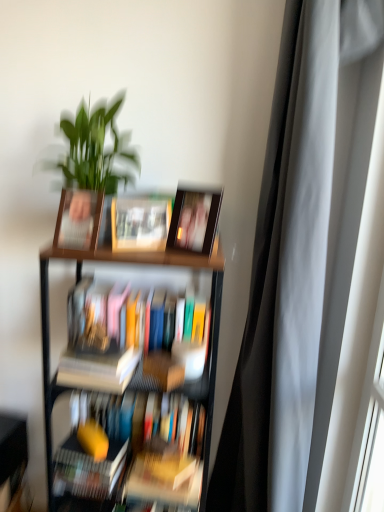
What do you see at coordinates (98, 370) in the screenshot?
I see `hardcover book at center, acting as the 2th book starting from the bottom` at bounding box center [98, 370].

Image resolution: width=384 pixels, height=512 pixels. What do you see at coordinates (130, 368) in the screenshot?
I see `wooden bookcase at center` at bounding box center [130, 368].

What is the approximate height of hardcover books at center, the 3th book ordered from the bottom?

hardcover books at center, the 3th book ordered from the bottom, is 9.67 inches in height.

Find the location of a particular element. matte wooden photo frame at center, which is the 4th book in bottom-to-top order is located at coordinates (140, 223).

This screenshot has width=384, height=512. I want to click on hardcover book at center, the third book when ordered from top to bottom, so click(98, 370).

Does hardcover book at center, acting as the 2th book starting from the bottom, lie in front of matte plastic picture frame at upper left, which is counted as the 2th picture frame, starting from the right?

No, hardcover book at center, acting as the 2th book starting from the bottom, is behind matte plastic picture frame at upper left, which is counted as the 2th picture frame, starting from the right.

From a real-world perspective, who is located higher, hardcover book at center, the third book when ordered from top to bottom, or matte plastic picture frame at upper left, marked as the 1th picture frame in a left-to-right arrangement?

matte plastic picture frame at upper left, marked as the 1th picture frame in a left-to-right arrangement.

Can you confirm if hardcover book at center, acting as the 2th book starting from the bottom, is positioned to the right of matte plastic picture frame at upper left, marked as the 1th picture frame in a left-to-right arrangement?

Yes.

Is matte plastic picture frame at upper left, which is counted as the 2th picture frame, starting from the right, surrounded by hardcover book at center, the third book when ordered from top to bottom?

Definitely not — matte plastic picture frame at upper left, which is counted as the 2th picture frame, starting from the right, is not inside hardcover book at center, the third book when ordered from top to bottom.

From a real-world perspective, starting from the matte wooden picture frame at upper center, placed as the second picture frame when sorted from left to right, which book is the 1st one below it? Please provide its 2D coordinates.

[(140, 223)]

Can you tell me how much matte wooden photo frame at center, which is the 4th book in bottom-to-top order, and matte wooden picture frame at upper center, placed as the second picture frame when sorted from left to right, differ in facing direction?

48.2 degrees separate the facing orientations of matte wooden photo frame at center, which is the 4th book in bottom-to-top order, and matte wooden picture frame at upper center, placed as the second picture frame when sorted from left to right.

Can you confirm if matte wooden photo frame at center, which is counted as the first book, starting from the top, is shorter than matte wooden picture frame at upper center, positioned as the 1th picture frame in right-to-left order?

Yes.

Considering the sizes of matte wooden photo frame at center, which is counted as the first book, starting from the top, and matte wooden picture frame at upper center, positioned as the 1th picture frame in right-to-left order, in the image, is matte wooden photo frame at center, which is counted as the first book, starting from the top, bigger or smaller than matte wooden picture frame at upper center, positioned as the 1th picture frame in right-to-left order,?

Clearly, matte wooden photo frame at center, which is counted as the first book, starting from the top, is smaller in size than matte wooden picture frame at upper center, positioned as the 1th picture frame in right-to-left order.

Considering the positions of objects green glossy plant at upper left and hardcover book at lower left, the 4th book from the top, in the image provided, who is more to the left, green glossy plant at upper left or hardcover book at lower left, the 4th book from the top,?

hardcover book at lower left, the 4th book from the top, is more to the left.

Considering the sizes of objects green glossy plant at upper left and hardcover book at lower left, acting as the 1th book starting from the bottom, in the image provided, who is taller, green glossy plant at upper left or hardcover book at lower left, acting as the 1th book starting from the bottom,?

Standing taller between the two is green glossy plant at upper left.

Is green glossy plant at upper left completely or partially outside of hardcover book at lower left, acting as the 1th book starting from the bottom?

Indeed, green glossy plant at upper left is completely outside hardcover book at lower left, acting as the 1th book starting from the bottom.

Could you tell me if matte wooden picture frame at upper center, positioned as the 1th picture frame in right-to-left order, is turned towards hardcover book at center, acting as the 2th book starting from the bottom?

No.

Is hardcover book at center, acting as the 2th book starting from the bottom, completely or partially inside matte wooden picture frame at upper center, positioned as the 1th picture frame in right-to-left order?

No.

From a real-world perspective, is matte wooden picture frame at upper center, positioned as the 1th picture frame in right-to-left order, positioned above or below hardcover book at center, the third book when ordered from top to bottom?

matte wooden picture frame at upper center, positioned as the 1th picture frame in right-to-left order, is situated higher than hardcover book at center, the third book when ordered from top to bottom, in the real world.

Is matte wooden picture frame at upper center, positioned as the 1th picture frame in right-to-left order, beside hardcover book at center, the third book when ordered from top to bottom?

No, matte wooden picture frame at upper center, positioned as the 1th picture frame in right-to-left order, is not touching hardcover book at center, the third book when ordered from top to bottom.

Is hardcover books at center, the second book in the top-to-bottom sequence, facing towards matte plastic picture frame at upper left, marked as the 1th picture frame in a left-to-right arrangement?

No, hardcover books at center, the second book in the top-to-bottom sequence, is not oriented towards matte plastic picture frame at upper left, marked as the 1th picture frame in a left-to-right arrangement.

From a real-world perspective, relative to matte plastic picture frame at upper left, marked as the 1th picture frame in a left-to-right arrangement, is hardcover books at center, the 3th book ordered from the bottom, vertically above or below?

In terms of real-world spatial position, hardcover books at center, the 3th book ordered from the bottom, is below matte plastic picture frame at upper left, marked as the 1th picture frame in a left-to-right arrangement.

Is hardcover books at center, the second book in the top-to-bottom sequence, taller than matte plastic picture frame at upper left, which is counted as the 2th picture frame, starting from the right?

Yes, hardcover books at center, the second book in the top-to-bottom sequence, is taller than matte plastic picture frame at upper left, which is counted as the 2th picture frame, starting from the right.

Does hardcover books at center, the 3th book ordered from the bottom, lie in front of matte plastic picture frame at upper left, marked as the 1th picture frame in a left-to-right arrangement?

No, hardcover books at center, the 3th book ordered from the bottom, is behind matte plastic picture frame at upper left, marked as the 1th picture frame in a left-to-right arrangement.

Considering the positions of points (15, 456) and (269, 187), is point (15, 456) closer to camera compared to point (269, 187)?

No, it is not.

Where is `shelf that appears behind the silky gray curtain at right`? The width and height of the screenshot is (384, 512). shelf that appears behind the silky gray curtain at right is located at coordinates (12, 457).

Which is more to the left, wooden bookshelf at lower left or silky gray curtain at right?

From the viewer's perspective, wooden bookshelf at lower left appears more on the left side.

From the image's perspective, does wooden bookshelf at lower left appear lower than silky gray curtain at right?

Yes, from the image's perspective, wooden bookshelf at lower left is below silky gray curtain at right.

Does point (304, 415) come behind point (192, 252)?

Yes, it is.

Is silky gray curtain at right thinner than matte wooden picture frame at upper center, placed as the second picture frame when sorted from left to right?

Incorrect, the width of silky gray curtain at right is not less than that of matte wooden picture frame at upper center, placed as the second picture frame when sorted from left to right.

What are the coordinates of `the 1st picture frame counting from the left side of the silky gray curtain at right` in the screenshot? It's located at point(194,219).

Is silky gray curtain at right beside matte wooden picture frame at upper center, positioned as the 1th picture frame in right-to-left order?

No, silky gray curtain at right is not in contact with matte wooden picture frame at upper center, positioned as the 1th picture frame in right-to-left order.

Where is `the 1st picture frame directly above the hardcover book at center, acting as the 2th book starting from the bottom (from a real-world perspective)`? The height and width of the screenshot is (512, 384). the 1st picture frame directly above the hardcover book at center, acting as the 2th book starting from the bottom (from a real-world perspective) is located at coordinates (78, 220).

In order to click on the 1st book counting from the left of the matte wooden picture frame at upper center, placed as the second picture frame when sorted from left to right in this screenshot , I will do `click(140, 223)`.

Estimate the real-world distances between objects in this image. Which object is further from green glossy plant at upper left, matte wooden picture frame at upper center, positioned as the 1th picture frame in right-to-left order, or matte wooden photo frame at center, which is counted as the first book, starting from the top?

matte wooden picture frame at upper center, positioned as the 1th picture frame in right-to-left order, is further to green glossy plant at upper left.

Which object lies further to the anchor point wooden bookshelf at lower left, matte wooden picture frame at upper center, placed as the second picture frame when sorted from left to right, or wooden bookcase at center?

matte wooden picture frame at upper center, placed as the second picture frame when sorted from left to right, is positioned further to the anchor wooden bookshelf at lower left.

From the image, which object appears to be farther from hardcover book at lower left, acting as the 1th book starting from the bottom, hardcover book at center, the third book when ordered from top to bottom, or matte plastic picture frame at upper left, which is counted as the 2th picture frame, starting from the right?

Among the two, matte plastic picture frame at upper left, which is counted as the 2th picture frame, starting from the right, is located further to hardcover book at lower left, acting as the 1th book starting from the bottom.

Which object lies further to the anchor point hardcover books at center, the second book in the top-to-bottom sequence, matte wooden photo frame at center, which is the 4th book in bottom-to-top order, or wooden bookcase at center?

Based on the image, matte wooden photo frame at center, which is the 4th book in bottom-to-top order, appears to be further to hardcover books at center, the second book in the top-to-bottom sequence.

From the image, which object appears to be farther from hardcover book at lower left, the 4th book from the top, wooden bookcase at center or silky gray curtain at right?

Based on the image, silky gray curtain at right appears to be further to hardcover book at lower left, the 4th book from the top.

From the image, which object appears to be farther from hardcover books at center, the 3th book ordered from the bottom, wooden bookcase at center or hardcover book at lower left, the 4th book from the top?

hardcover book at lower left, the 4th book from the top, is further to hardcover books at center, the 3th book ordered from the bottom.

From the image, which object appears to be farther from hardcover books at center, the second book in the top-to-bottom sequence, silky gray curtain at right or matte plastic picture frame at upper left, which is counted as the 2th picture frame, starting from the right?

Based on the image, silky gray curtain at right appears to be further to hardcover books at center, the second book in the top-to-bottom sequence.

When comparing their distances from silky gray curtain at right, does hardcover book at lower left, the 4th book from the top, or matte wooden picture frame at upper center, positioned as the 1th picture frame in right-to-left order, seem further?

Among the two, hardcover book at lower left, the 4th book from the top, is located further to silky gray curtain at right.

Where is `houseplant between matte plastic picture frame at upper left, marked as the 1th picture frame in a left-to-right arrangement, and silky gray curtain at right from left to right`? Image resolution: width=384 pixels, height=512 pixels. houseplant between matte plastic picture frame at upper left, marked as the 1th picture frame in a left-to-right arrangement, and silky gray curtain at right from left to right is located at coordinates (90, 170).

This screenshot has width=384, height=512. I want to click on picture frame situated between green glossy plant at upper left and silky gray curtain at right from left to right, so click(194, 219).

The image size is (384, 512). In order to click on bookcase between green glossy plant at upper left and hardcover book at lower left, the 4th book from the top, in the up-down direction in this screenshot , I will do `click(130, 368)`.

At what (x,y) coordinates should I click in order to perform the action: click on curtain between matte wooden picture frame at upper center, positioned as the 1th picture frame in right-to-left order, and wooden bookcase at center from top to bottom. Please return your answer as a coordinate pair (x, y). The height and width of the screenshot is (512, 384). Looking at the image, I should click on (289, 287).